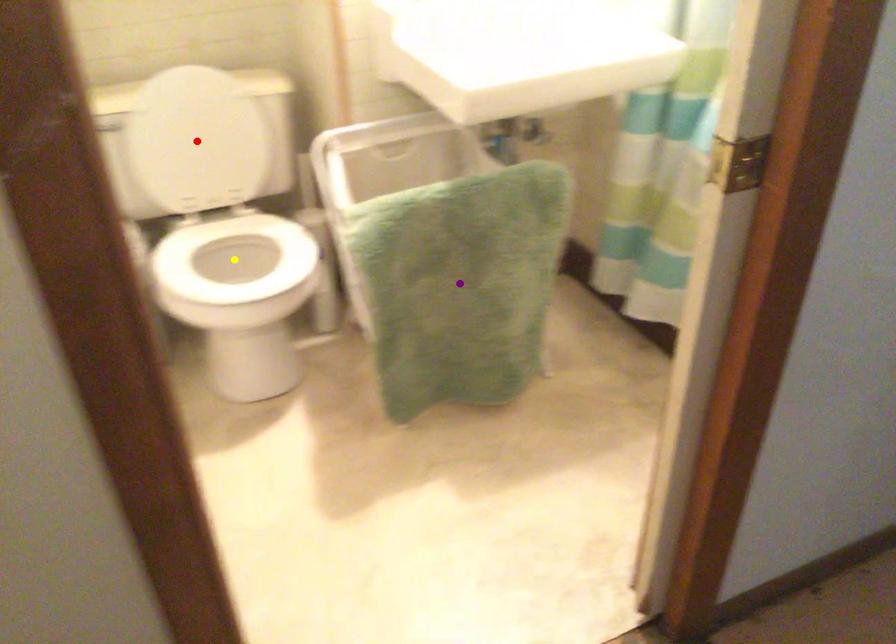
Order these from nearest to farthest:
purple point | yellow point | red point

purple point → yellow point → red point